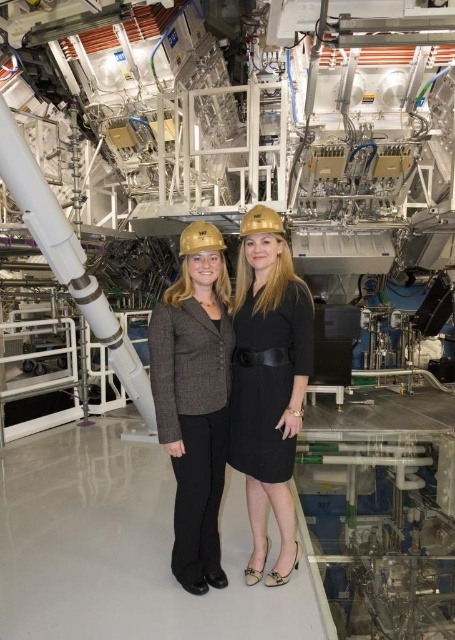
The width and height of the screenshot is (455, 640). I want to click on black matte dress at center, so click(267, 384).

Can you confirm if black matte dress at center is thinner than gray tweed blazer at center?

Incorrect, black matte dress at center's width is not less than gray tweed blazer at center's.

Is point (249, 497) positioned behind point (160, 346)?

Yes.

This screenshot has height=640, width=455. I want to click on black matte dress at center, so click(267, 384).

Is point (274, 429) positioned before point (187, 241)?

That is False.

Does black matte dress at center appear on the right side of gold matte hard hat at center?

Indeed, black matte dress at center is positioned on the right side of gold matte hard hat at center.

Locate an element on the screen. This screenshot has width=455, height=640. black matte dress at center is located at coordinates tap(267, 384).

You are a GUI agent. You are given a task and a screenshot of the screen. Output one action in this format:
    pyautogui.click(x=<x>, y=<y>)
    Task: Click on the black matte dress at center
    The height and width of the screenshot is (640, 455).
    Given the screenshot: What is the action you would take?
    pyautogui.click(x=267, y=384)

Is gray tweed blazer at center positioned before gold matte hard hat at center?

That is True.

Can you confirm if gray tweed blazer at center is positioned to the left of gold matte hard hat at center?

Yes, gray tweed blazer at center is to the left of gold matte hard hat at center.

Which is behind, point (221, 314) or point (192, 237)?

The point (221, 314) is more distant.

Find the location of a particular element. gray tweed blazer at center is located at coordinates (195, 400).